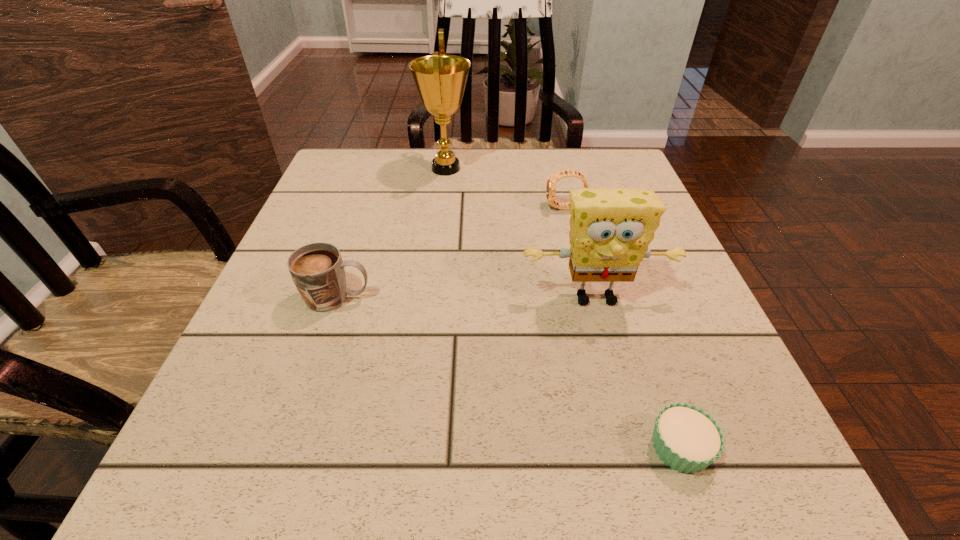
At what (x,y) coordinates should I click in order to perform the action: click on award. Please return your answer as a coordinate pair (x, y). This screenshot has width=960, height=540. Looking at the image, I should click on (440, 79).

Find the location of a particular element. Image resolution: width=960 pixels, height=540 pixels. the fourth object from right to left is located at coordinates (440, 79).

Identify the location of sponge. (610, 229).

Where is `the leftmost object`? The height and width of the screenshot is (540, 960). the leftmost object is located at coordinates (317, 269).

The height and width of the screenshot is (540, 960). Identify the location of the fourth nearest object. (554, 178).

Locate an element on the screen. The width and height of the screenshot is (960, 540). the shortest object is located at coordinates (687, 439).

Locate an element on the screen. Image resolution: width=960 pixels, height=540 pixels. cupcake is located at coordinates (687, 439).

What are the coordinates of `vacant space situated on the front view with handles of the tallest object` in the screenshot? It's located at (579, 168).

Locate an element on the screen. Image resolution: width=960 pixels, height=540 pixels. vacant space located 0.070m on the face of the second tallest object is located at coordinates (610, 351).

The width and height of the screenshot is (960, 540). I want to click on vacant space located on the side of the mug with the handle, so click(x=473, y=298).